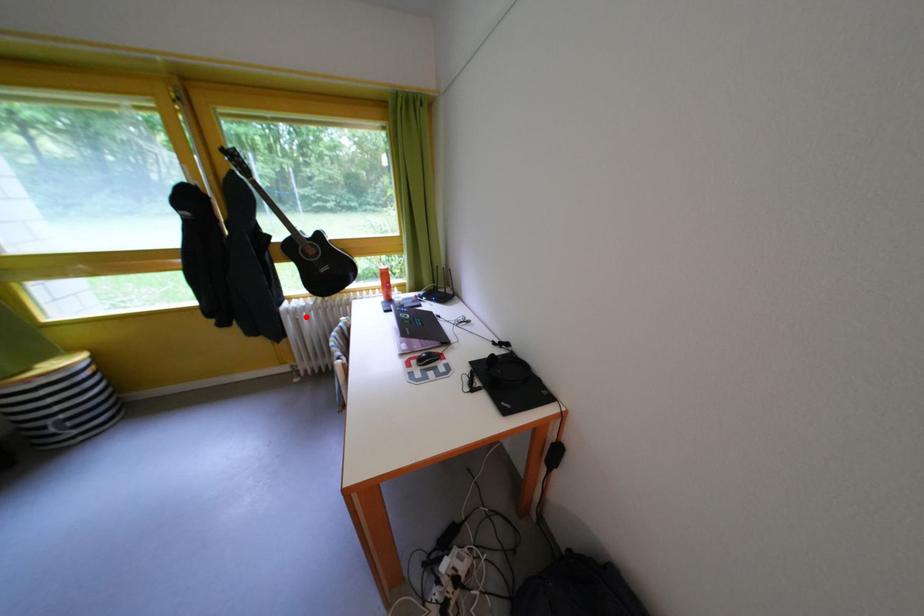
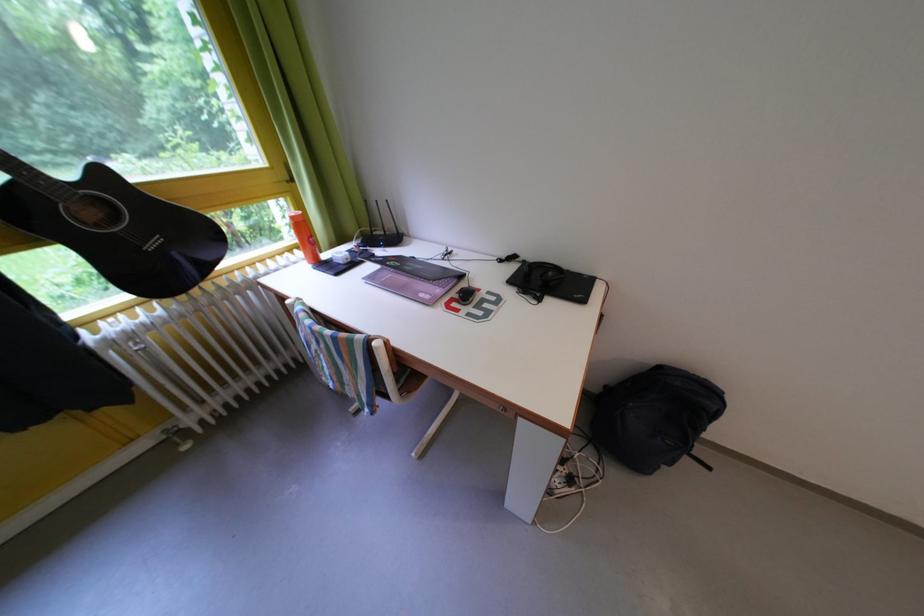
Find the pixel in the second image that matches the highlighted location in the first image.

(140, 342)